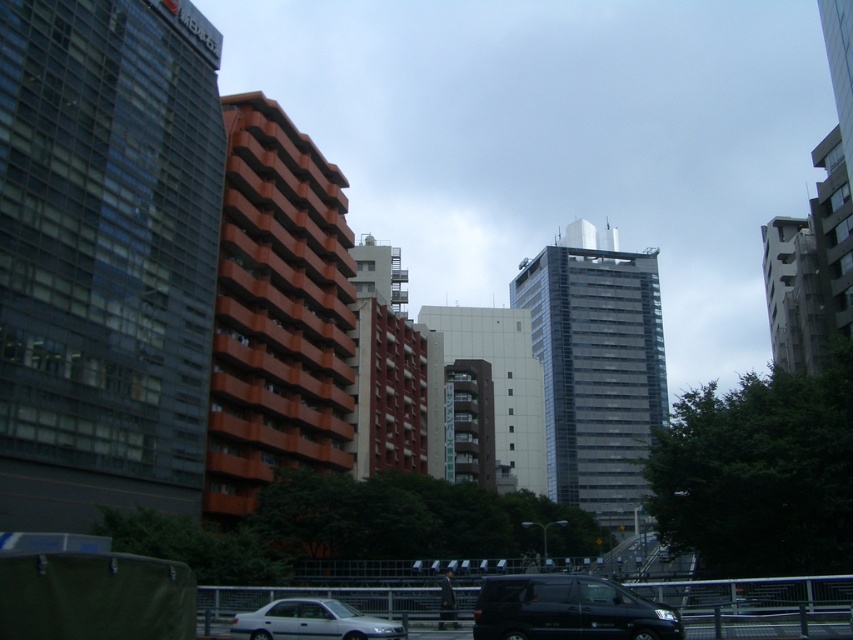
You are a pedestrian standing at the edge of the street looking towards the buildings. You notice a black matte van at lower center and a silver metallic car at center. Which vehicle is positioned higher from the ground?

The black matte van at lower center is positioned higher from the ground than the silver metallic car at center according to the description.

You are standing at the origin point of the image coordinate system. You want to locate the black matte van at lower center. Which direction should you move in the coordinate system to reach it?

You should move towards the positive x and y directions in the coordinate system to reach the black matte van at lower center located at point [567,609].

You are a pedestrian standing at the crosswalk in front of the buildings. You see a black matte van at lower center and a silver metallic car at center. Which vehicle is closer to you?

The black matte van at lower center is closer to you because it is positioned in front of the silver metallic car at center.